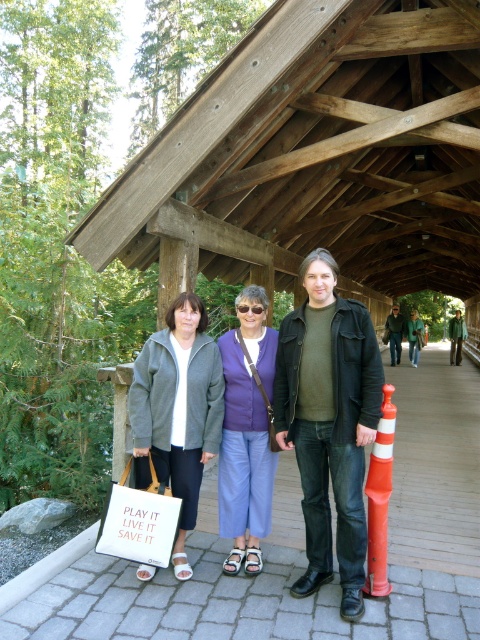
Is matte gray jacket at center further to camera compared to matte purple sweater at center?

No.

Which is below, matte gray jacket at center or matte purple sweater at center?

matte purple sweater at center is below.

Image resolution: width=480 pixels, height=640 pixels. In order to click on matte gray jacket at center in this screenshot , I will do `click(178, 410)`.